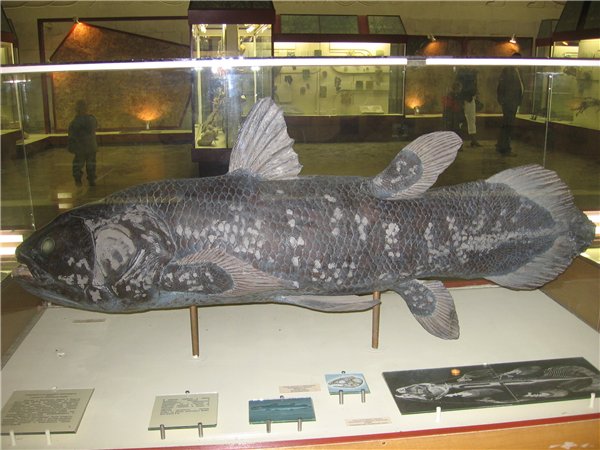
Identify the location of display case. (346, 134), (213, 108), (353, 88), (567, 93).